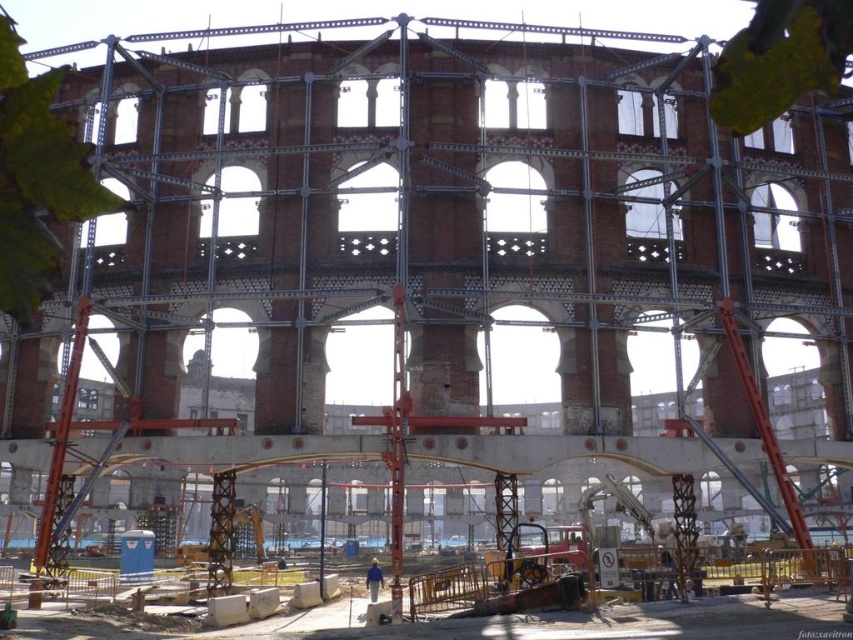
Question: Does rustic wood construction site at lower center appear on the right side of blue fabric construction worker at center?

Choices:
 (A) yes
 (B) no

Answer: (A)

Question: Which point is farther from the camera taking this photo?

Choices:
 (A) (376, 566)
 (B) (840, 625)

Answer: (A)

Question: From the image, what is the correct spatial relationship of rustic wood construction site at lower center in relation to blue fabric construction worker at center?

Choices:
 (A) right
 (B) left

Answer: (A)

Question: Is rustic wood construction site at lower center bigger than blue fabric construction worker at center?

Choices:
 (A) yes
 (B) no

Answer: (A)

Question: Which point is closer to the camera?

Choices:
 (A) blue fabric construction worker at center
 (B) rustic wood construction site at lower center

Answer: (B)

Question: Which of the following is the closest to the observer?

Choices:
 (A) blue fabric construction worker at center
 (B) rustic wood construction site at lower center

Answer: (B)